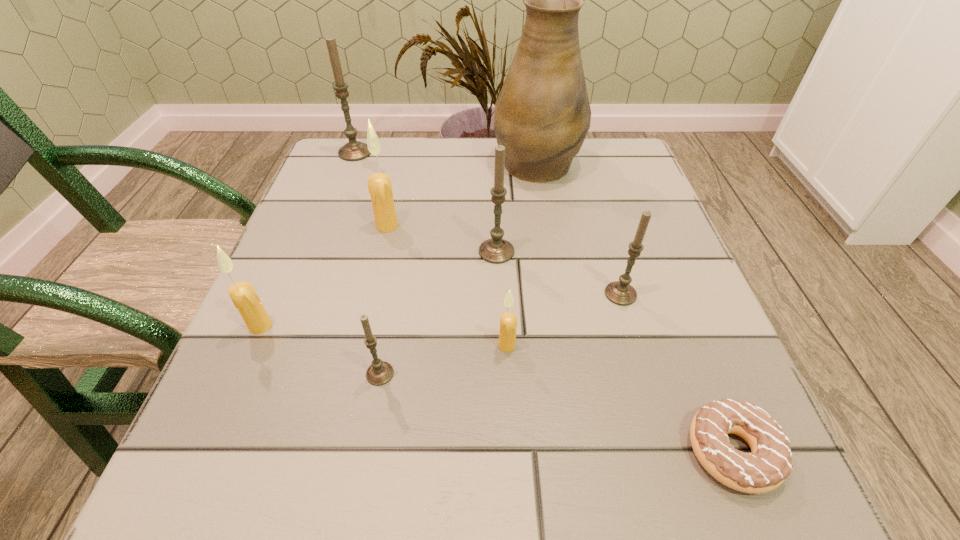
The height and width of the screenshot is (540, 960). What are the coordinates of `vacant space at the far right corner of the desktop` in the screenshot? It's located at pyautogui.click(x=594, y=145).

In the image, there is a desktop. At what (x,y) coordinates should I click in order to perform the action: click on free space at the near right corner. Please return your answer as a coordinate pair (x, y). The height and width of the screenshot is (540, 960). Looking at the image, I should click on (660, 490).

Where is `vacant space that is in between the sixth farthest candle and the nearest gray candle`? Image resolution: width=960 pixels, height=540 pixels. vacant space that is in between the sixth farthest candle and the nearest gray candle is located at coordinates (444, 360).

Find the location of a particular element. This screenshot has height=540, width=960. vacant region between the fourth farthest candle and the nearest object is located at coordinates [676, 373].

The width and height of the screenshot is (960, 540). Identify the location of vacant point located between the chocolate doughnut and the biggest cream candle. (560, 339).

This screenshot has height=540, width=960. What are the coordinates of `empty location between the tallest object and the nearest gray candle` in the screenshot? It's located at (458, 267).

The image size is (960, 540). What are the coordinates of `empty location between the second gray candle from right to left and the shortest object` in the screenshot? It's located at (614, 352).

Identify the location of free spot between the third gray candle from left to right and the fifth farthest object. Image resolution: width=960 pixels, height=540 pixels. (559, 273).

At what (x,y) coordinates should I click in order to perform the action: click on free spot between the doughnut and the second gray candle from right to left. Please return your answer as a coordinate pair (x, y). This screenshot has height=540, width=960. Looking at the image, I should click on (614, 352).

You are a GUI agent. You are given a task and a screenshot of the screen. Output one action in this format:
    pyautogui.click(x=<x>, y=<y>)
    Task: Click on the vacant point located between the fourth nearest object and the smallest gray candle
    This screenshot has width=960, height=540.
    Given the screenshot: What is the action you would take?
    pyautogui.click(x=321, y=349)